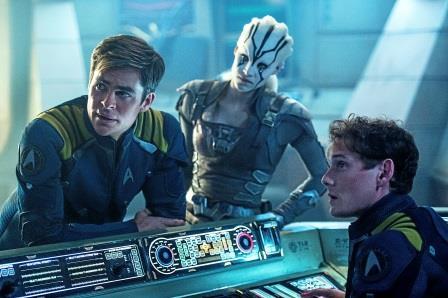
This screenshot has width=448, height=298. In order to click on screen in this screenshot , I will do `click(202, 242)`.